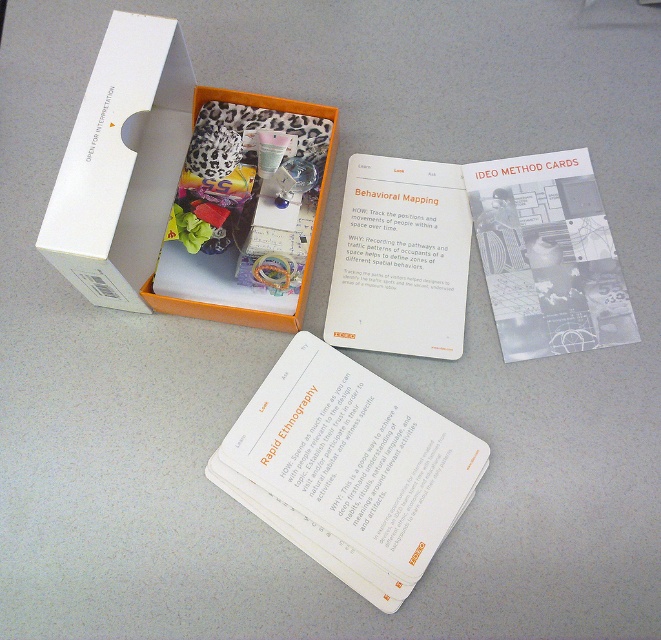
Question: Among these points, which one is farthest from the camera?

Choices:
 (A) (393, 522)
 (B) (136, 272)

Answer: (B)

Question: Can you confirm if white paper cards at center is positioned to the right of white cardboard box at upper left?

Choices:
 (A) no
 (B) yes

Answer: (B)

Question: Can you confirm if white paper cards at center is thinner than white cardboard box at upper left?

Choices:
 (A) yes
 (B) no

Answer: (B)

Question: Which object is closer to the camera taking this photo?

Choices:
 (A) white paper cards at center
 (B) white cardboard box at upper left

Answer: (B)

Question: Does white paper cards at center have a lesser width compared to white cardboard box at upper left?

Choices:
 (A) yes
 (B) no

Answer: (B)